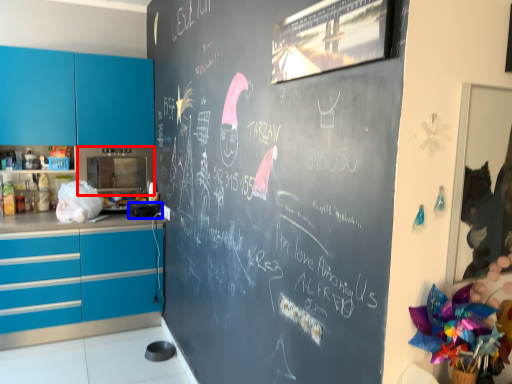
Question: Which point is further to the camera, appliance (highlighted by a red box) or appliance (highlighted by a blue box)?

Choices:
 (A) appliance
 (B) appliance

Answer: (A)